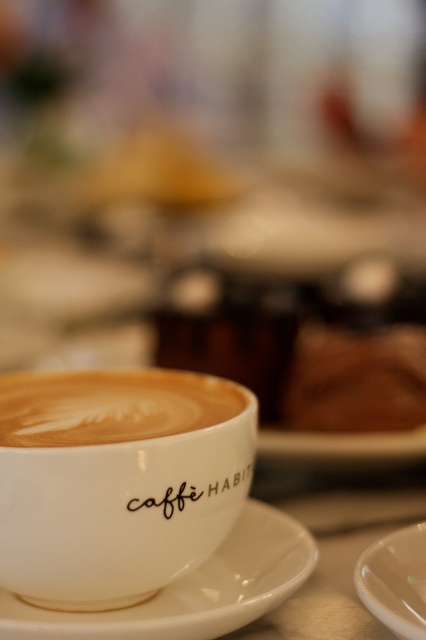
The image size is (426, 640). In order to click on white matte cup at center in this screenshot , I will do `click(117, 481)`.

Who is more distant from viewer, (155, 428) or (180, 488)?

Positioned behind is point (155, 428).

In the scene shown: Who is more forward, (48, 504) or (176, 496)?

Point (48, 504) is in front.

You are a GUI agent. You are given a task and a screenshot of the screen. Output one action in this format:
    pyautogui.click(x=<x>, y=<y>)
    Task: Click on the white matte cup at center
    This screenshot has width=426, height=640.
    Given the screenshot: What is the action you would take?
    pyautogui.click(x=117, y=481)

Which is behind, point (37, 403) or point (400, 621)?

Positioned behind is point (37, 403).

Identify the location of latte art at center. 109,404.

Does white matte cup at center have a lesser width compared to latte art at center?

No.

Is point (78, 508) closer to camera compared to point (184, 388)?

That is True.

Is point (221, 397) positioned in front of point (86, 397)?

That is True.

Identify the location of white matte cup at center. The width and height of the screenshot is (426, 640). (117, 481).